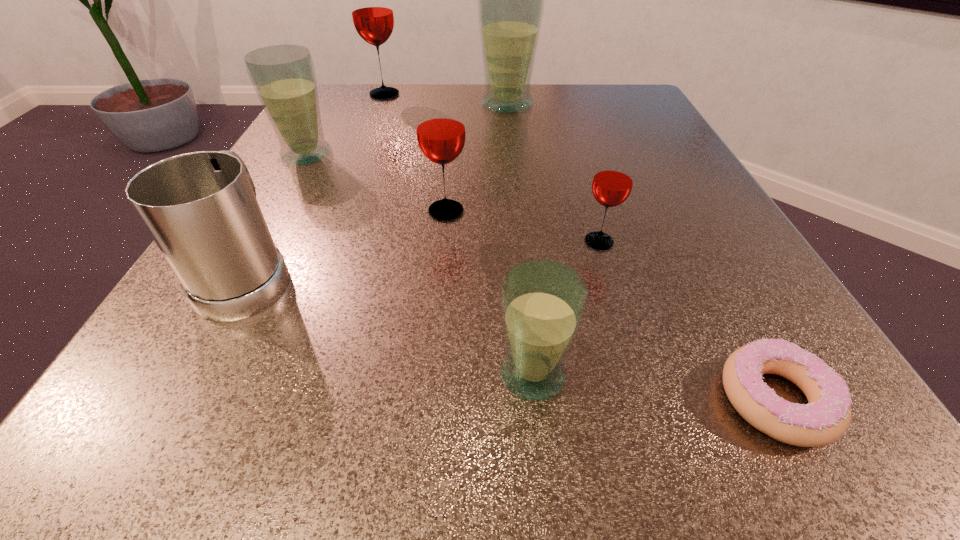
This screenshot has width=960, height=540. I want to click on blank space located on the side of the gray mug with the handle, so click(x=331, y=124).

At what (x,y) coordinates should I click in order to perform the action: click on free space located 0.240m on the left of the rightmost glass. Please return your answer as a coordinate pair (x, y). Looking at the image, I should click on (418, 242).

Locate an element on the screen. The width and height of the screenshot is (960, 540). vacant space located 0.350m on the left of the smallest blue glass is located at coordinates (180, 374).

Locate an element on the screen. This screenshot has height=540, width=960. vacant space situated on the back of the pink doughnut is located at coordinates (665, 194).

What are the coordinates of `glass at the near edge` in the screenshot? It's located at (543, 302).

Locate an element on the screen. The width and height of the screenshot is (960, 540). doughnut that is at the near edge is located at coordinates (826, 417).

I want to click on mug that is at the left edge, so click(200, 208).

I want to click on object at the right edge, so tap(826, 417).

Image resolution: width=960 pixels, height=540 pixels. Identify the location of object that is at the far left corner. (372, 13).

In order to click on object that is at the near right corner in this screenshot , I will do `click(826, 417)`.